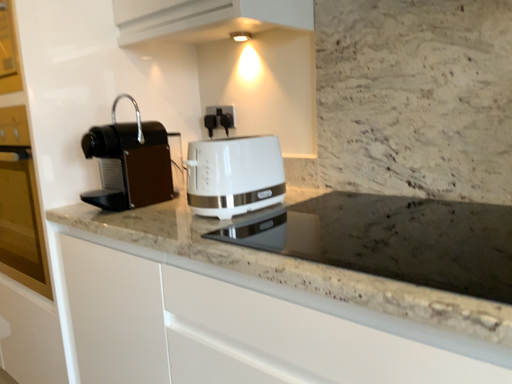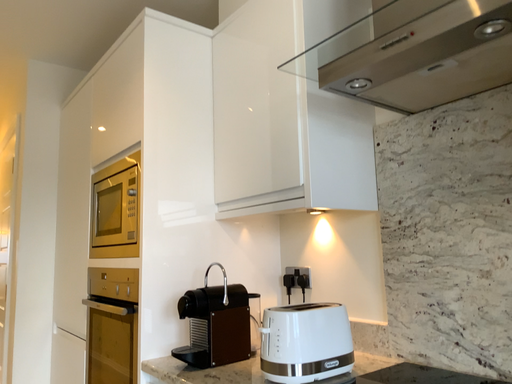
Question: How did the camera likely rotate when shooting the video?

Choices:
 (A) rotated downward
 (B) rotated upward

Answer: (B)